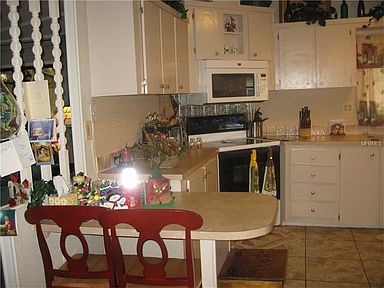
The image size is (384, 288). What are the coordinates of `beige melamine wall mounted kitchen table` in the screenshot? It's located at (241, 220).